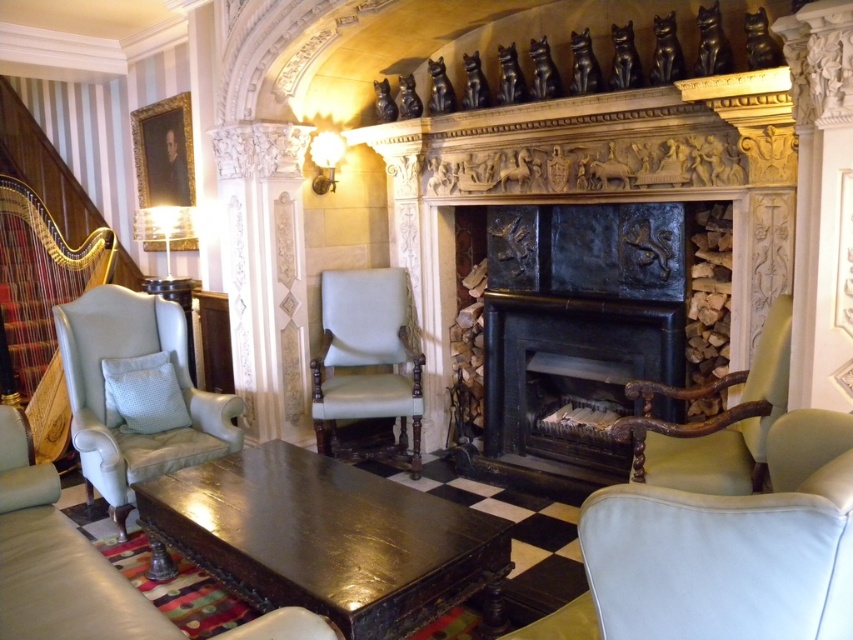
Question: Among these points, which one is farthest from the camera?

Choices:
 (A) (337, 483)
 (B) (10, 436)
 (C) (233, 404)
 (D) (381, 316)

Answer: (D)

Question: Among these objects, which one is farthest from the camera?

Choices:
 (A) light blue leather armchair at left
 (B) matte gold lampshade at upper center
 (C) light beige fabric armchair at center

Answer: (B)

Question: Is leather couch at center thinner than matte gold lampshade at upper center?

Choices:
 (A) yes
 (B) no

Answer: (B)

Question: Can you confirm if light blue leather armchair at left is positioned to the right of light beige fabric armchair at center?

Choices:
 (A) no
 (B) yes

Answer: (A)

Question: Which of the following is the closest to the observer?

Choices:
 (A) matte gold lampshade at upper center
 (B) shiny dark wood coffee table at center

Answer: (B)

Question: Is leather couch at center positioned behind light beige fabric armchair at center?

Choices:
 (A) no
 (B) yes

Answer: (A)